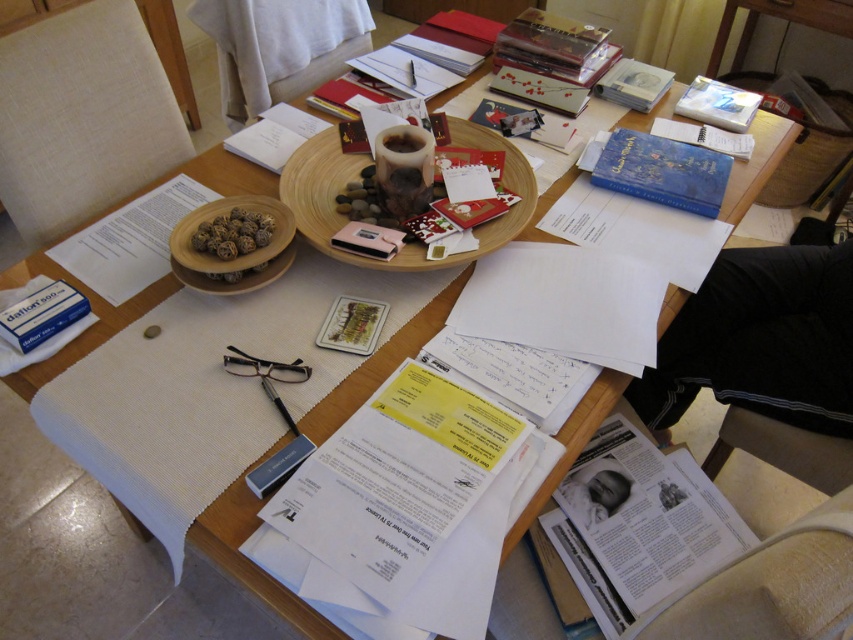
Is wooden tray at center taller than red matte card at center?

Yes, wooden tray at center is taller than red matte card at center.

From the picture: Who is more forward, (x=486, y=145) or (x=439, y=202)?

Point (x=439, y=202)

At what (x,y) coordinates should I click in order to perform the action: click on wooden tray at center. Please return your answer as a coordinate pair (x, y). The image size is (853, 640). Looking at the image, I should click on (358, 177).

Is blue matte book at upper right positioned before wooden textured card at center?

No, it is behind wooden textured card at center.

Is blue matte book at upper right positioned behind wooden textured card at center?

Yes, blue matte book at upper right is behind wooden textured card at center.

Is point (723, 163) positioned before point (376, 330)?

No.

I want to click on blue matte book at upper right, so click(x=663, y=172).

Between white matte book at upper right and matte paper book at center, which one has more height?

white matte book at upper right is taller.

Is white matte book at upper right in front of matte paper book at center?

Yes, it is in front of matte paper book at center.

Is point (717, 120) closer to camera compared to point (512, 80)?

Yes, it is.

Locate an element on the screen. The height and width of the screenshot is (640, 853). white matte book at upper right is located at coordinates (718, 104).